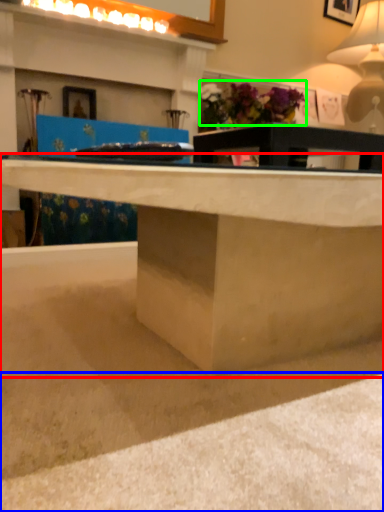
Question: Which is nearer to the desk (highlighted by a red box)? concrete (highlighted by a blue box) or flower (highlighted by a green box).

Choices:
 (A) concrete
 (B) flower

Answer: (A)